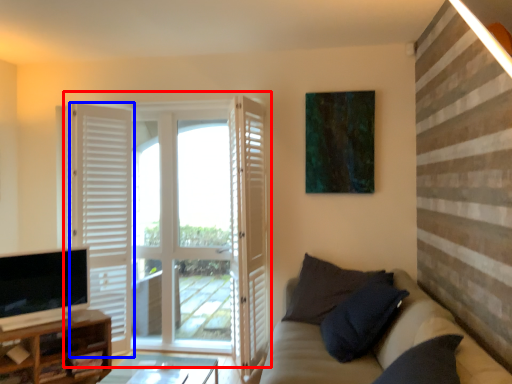
Question: Among these objects, which one is farthest to the camera, door (highlighted by a red box) or door (highlighted by a blue box)?

Choices:
 (A) door
 (B) door

Answer: (A)